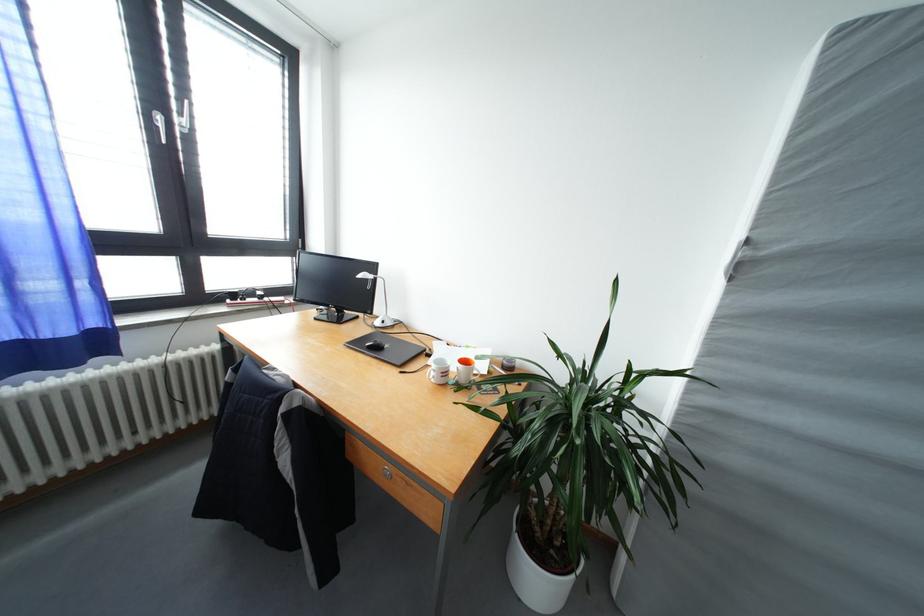
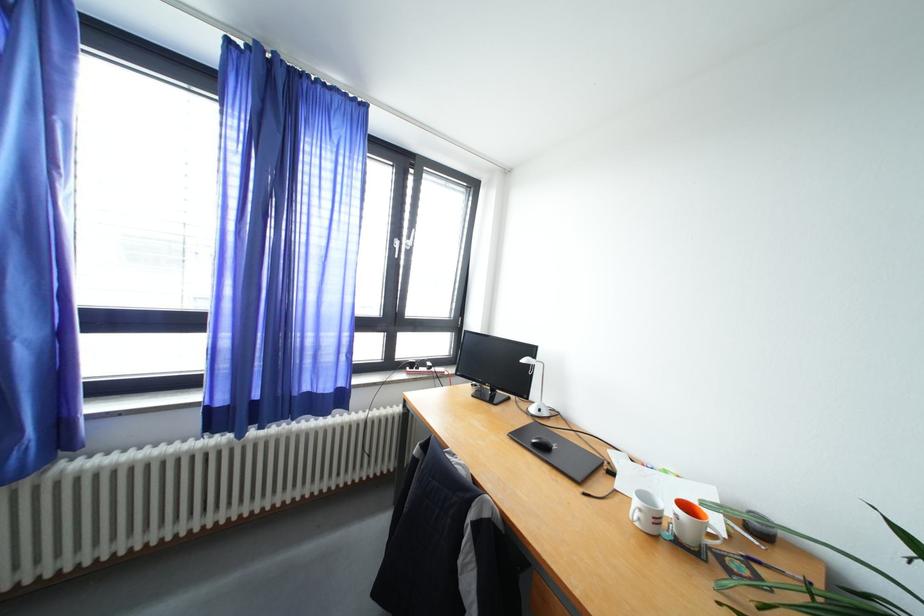
Find the pixel in the second image that matches (239,301) in the first image.

(419, 370)